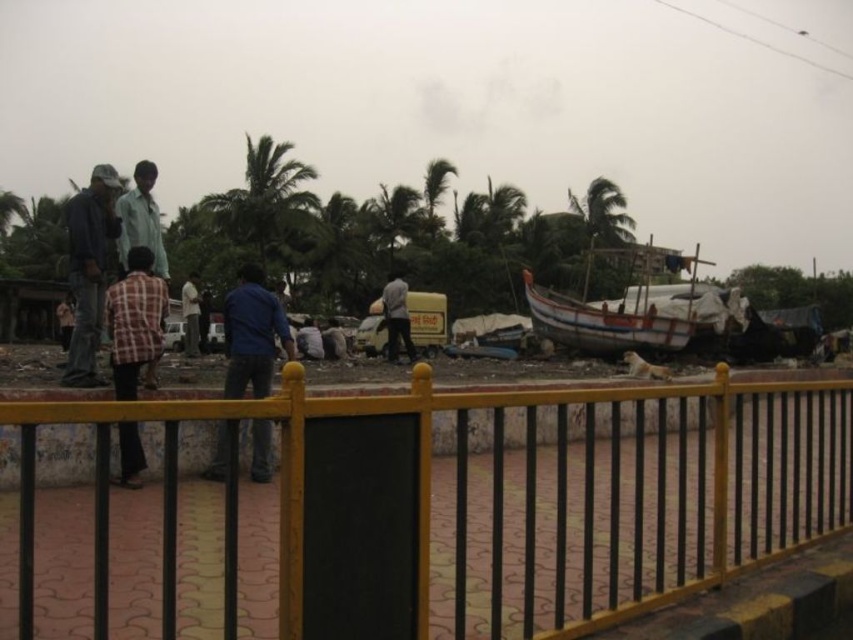
You are standing on the walkway near the yellow and black metal railing. You see two people in the scene, one wearing blue denim jeans at center and another wearing plaid fabric shirt at lower left. Which person is closer to you?

The blue denim jeans at center is closer to the viewer than the plaid fabric shirt at lower left, so the person wearing blue denim jeans at center is closer to you.

You are a photographer standing at the riverside and notice two people wearing dark blue jeans at center and light brown shirt at center. Which clothing item is covering the other?

The dark blue jeans at center is positioned over light brown shirt at center, so the jeans are covering the shirt.

You are a photographer standing at the riverside and want to capture a photo of the dark blue jeans at center and the light brown shirt at center. Which object should you focus on first if you want to include both in the frame without moving the camera?

You should focus on the dark blue jeans at center first because it is shorter than the light brown shirt at center, allowing both to be in the frame by adjusting the camera angle slightly upwards.